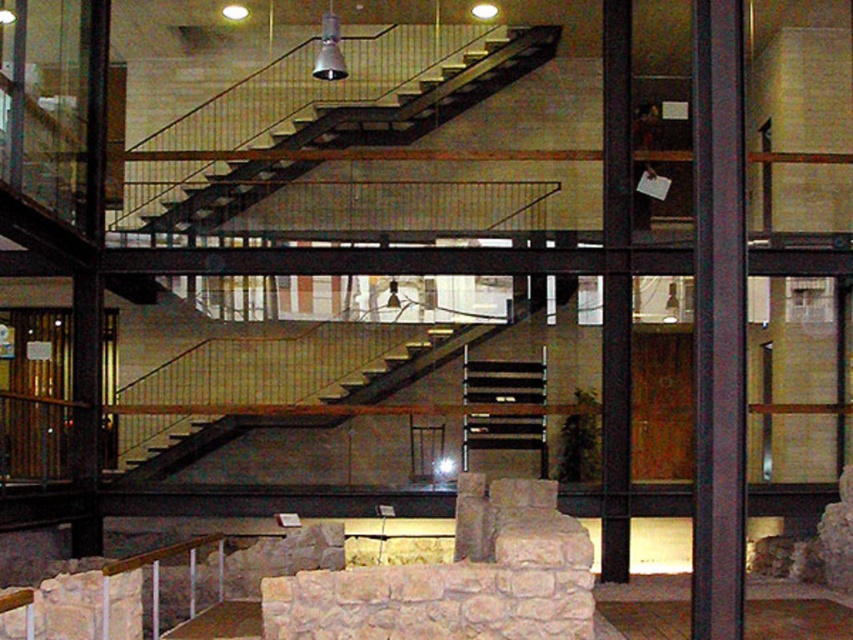
You are an architect designing a new exhibition space. You need to place a large sculpture that requires a minimum width of 2 meters. Given the metallic staircase at center and the dark brown wood pillar at right, which one can accommodate the sculpture based on their widths?

The metallic staircase at center has a greater width than the dark brown wood pillar at right, so the sculpture can be placed at the metallic staircase at center as it meets the minimum width requirement of 2 meters.

You are an interior designer planning to place a large sculpture between the metallic staircase at center and the dark brown wood pillar at right. Based on their positions, which object should the sculpture be closer to?

The metallic staircase at center is positioned on the left side of dark brown wood pillar at right, so the sculpture should be placed closer to the dark brown wood pillar at right to maintain symmetry.